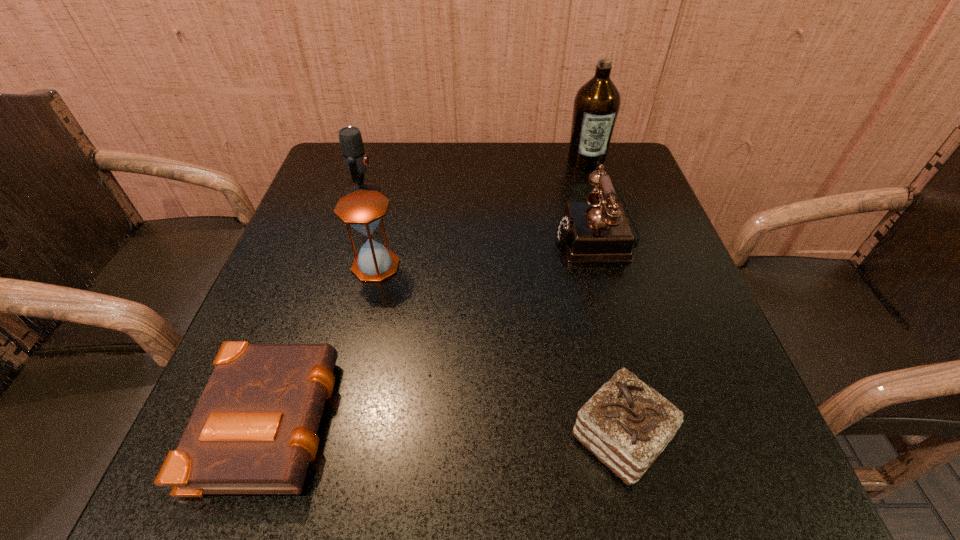
You are a GUI agent. You are given a task and a screenshot of the screen. Output one action in this format:
    pyautogui.click(x=<x>, y=<y>)
    Task: Click on the free point that satisfies the following two spatial constraints: 1. on the dial of the telephone; 2. on the front side of the hourglass
    
    Given the screenshot: What is the action you would take?
    pyautogui.click(x=605, y=266)

Locate an element on the screen. This screenshot has height=540, width=960. blank area in the image that satisfies the following two spatial constraints: 1. on the label of the farthest object; 2. on the dial of the telephone is located at coordinates (610, 237).

Identify the location of free space that satisfies the following two spatial constraints: 1. on the label of the olive oil; 2. on the side of the second farthest object with the red ring. This screenshot has height=540, width=960. (596, 192).